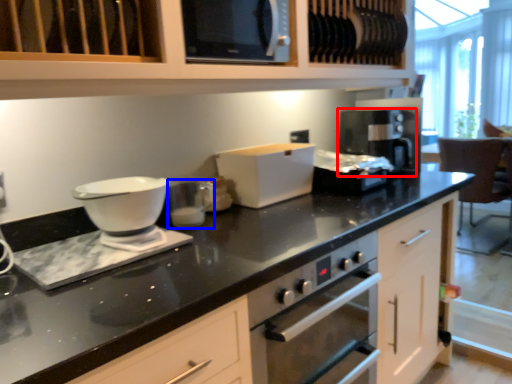
Question: Among these objects, which one is nearest to the camera, coffee machine (highlighted by a red box) or appliance (highlighted by a blue box)?

Choices:
 (A) coffee machine
 (B) appliance

Answer: (B)